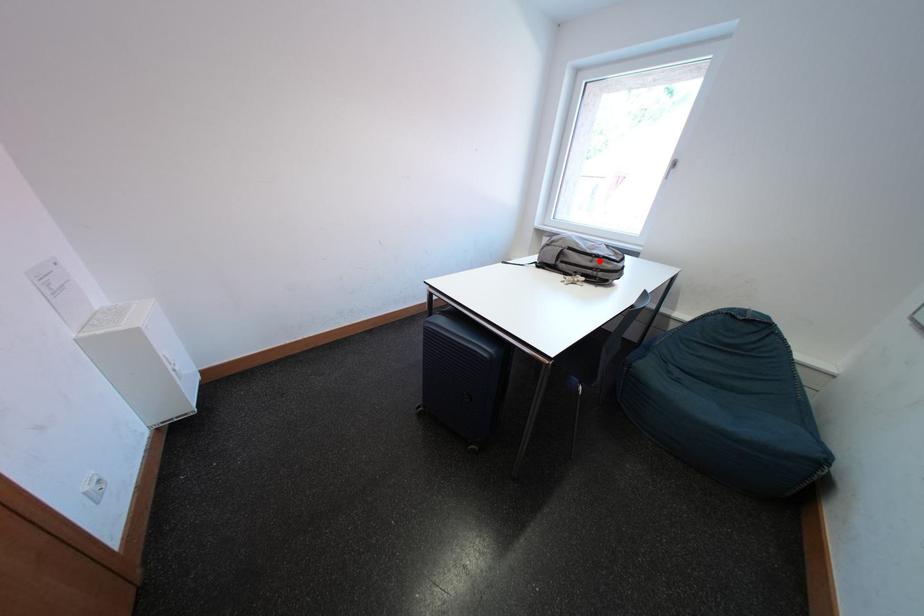
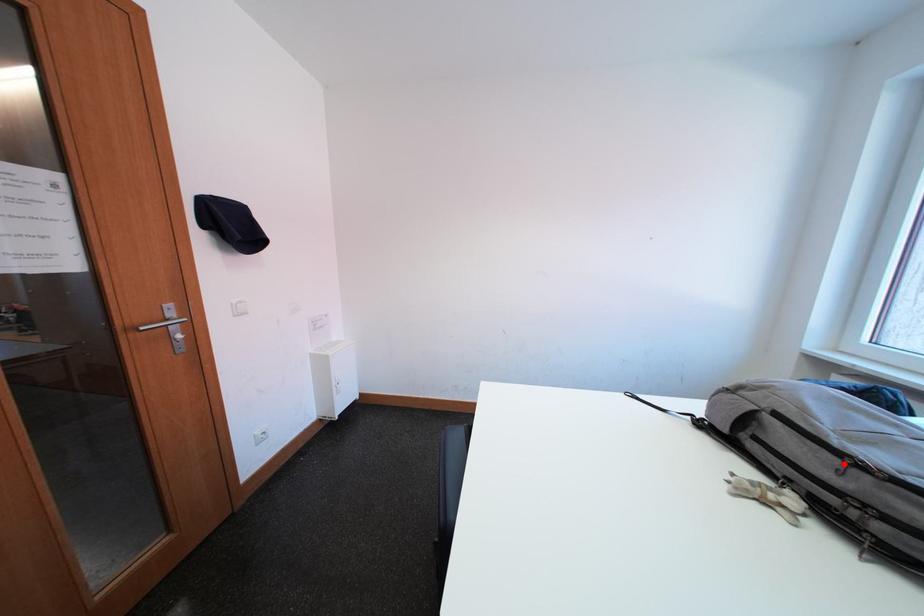
I am providing you with two images of the same scene from different viewpoints. A red point is marked on the first image and another point is marked on the second image. Does the point marked in image1 correspond to the same location as the one in image2?

Yes